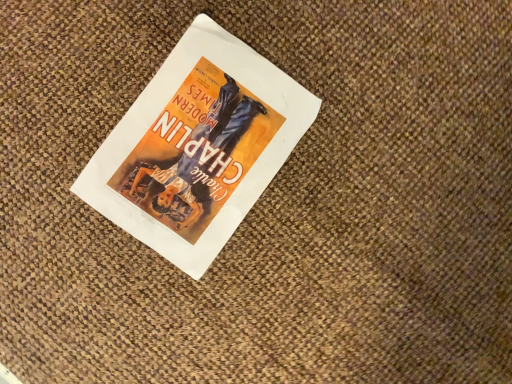
This screenshot has height=384, width=512. I want to click on white paper poster at center, so click(198, 147).

Describe the element at coordinates (198, 147) in the screenshot. The height and width of the screenshot is (384, 512). I see `white paper poster at center` at that location.

Identify the location of white paper poster at center. (198, 147).